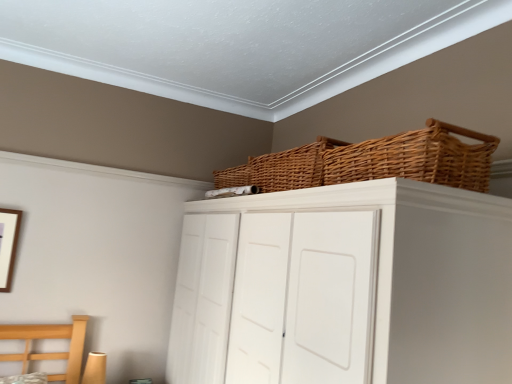
This screenshot has width=512, height=384. What do you see at coordinates (414, 158) in the screenshot?
I see `woven brown basket at upper center, arranged as the second basket when viewed from the back` at bounding box center [414, 158].

Locate an element on the screen. The height and width of the screenshot is (384, 512). wooden picture frame at left is located at coordinates (8, 245).

From a real-world perspective, is white matte cupboard at upper center beneath woven brown basket at upper center, the 2th basket in the front-to-back sequence?

Indeed, from a real-world perspective, white matte cupboard at upper center is positioned beneath woven brown basket at upper center, the 2th basket in the front-to-back sequence.

From the image's perspective, is white matte cupboard at upper center located above or below woven brown basket at upper center, the 2th basket in the front-to-back sequence?

Clearly, from the image's perspective, white matte cupboard at upper center is below woven brown basket at upper center, the 2th basket in the front-to-back sequence.

Is white matte cupboard at upper center in front of woven brown basket at upper center, the 2th basket in the front-to-back sequence?

Yes, white matte cupboard at upper center is in front of woven brown basket at upper center, the 2th basket in the front-to-back sequence.

Which is farther, (452, 192) or (293, 160)?

The point (293, 160) is behind.

In the image, there is a woven brown basket at upper center, positioned as the 1th basket in front-to-back order. At what (x,y) coordinates should I click in order to perform the action: click on basket below it (from the image's perspective). Please return your answer as a coordinate pair (x, y). Image resolution: width=512 pixels, height=384 pixels. Looking at the image, I should click on (280, 169).

Considering the positions of points (345, 157) and (304, 165), is point (345, 157) closer to camera compared to point (304, 165)?

Yes, point (345, 157) is closer to viewer.

Could woven brown basket at upper center, which ranks as the 1th basket in back-to-front order, be considered to be inside woven brown basket at upper center, positioned as the 1th basket in front-to-back order?

No, woven brown basket at upper center, which ranks as the 1th basket in back-to-front order, is not inside woven brown basket at upper center, positioned as the 1th basket in front-to-back order.

Can you tell me how much woven brown basket at upper center, positioned as the 1th basket in front-to-back order, and woven brown basket at upper center, which ranks as the 1th basket in back-to-front order, differ in facing direction?

The angle between the facing direction of woven brown basket at upper center, positioned as the 1th basket in front-to-back order, and the facing direction of woven brown basket at upper center, which ranks as the 1th basket in back-to-front order, is 2.01e-05 degrees.

Looking at their sizes, would you say wooden picture frame at left is wider or thinner than white matte cupboard at upper center?

Considering their sizes, wooden picture frame at left looks slimmer than white matte cupboard at upper center.

From the image's perspective, which is above, wooden picture frame at left or white matte cupboard at upper center?

wooden picture frame at left, from the image's perspective.

The width and height of the screenshot is (512, 384). In order to click on cupboard located in front of the wooden picture frame at left in this screenshot , I will do `click(345, 287)`.

From the image's perspective, does woven brown basket at upper center, the 2th basket in the front-to-back sequence, appear lower than wooden picture frame at left?

No, from the image's perspective, woven brown basket at upper center, the 2th basket in the front-to-back sequence, is not beneath wooden picture frame at left.

Based on the photo, would you say woven brown basket at upper center, the 2th basket in the front-to-back sequence, is outside wooden picture frame at left?

Absolutely, woven brown basket at upper center, the 2th basket in the front-to-back sequence, is external to wooden picture frame at left.

Which of these two, woven brown basket at upper center, which ranks as the 1th basket in back-to-front order, or wooden picture frame at left, is bigger?

woven brown basket at upper center, which ranks as the 1th basket in back-to-front order.

Is wooden picture frame at left at the back of woven brown basket at upper center, which ranks as the 1th basket in back-to-front order?

No.

Is point (10, 266) in front of point (415, 162)?

No, (10, 266) is behind (415, 162).

Are wooden picture frame at left and woven brown basket at upper center, arranged as the second basket when viewed from the back, making contact?

No, wooden picture frame at left is not in contact with woven brown basket at upper center, arranged as the second basket when viewed from the back.

Locate an element on the screen. picture frame below the woven brown basket at upper center, positioned as the 1th basket in front-to-back order (from a real-world perspective) is located at coordinates (8, 245).

From the image's perspective, which object appears higher, wooden picture frame at left or woven brown basket at upper center, arranged as the second basket when viewed from the back?

woven brown basket at upper center, arranged as the second basket when viewed from the back, is shown above in the image.

Can you confirm if woven brown basket at upper center, arranged as the second basket when viewed from the back, is smaller than wooden picture frame at left?

Incorrect, woven brown basket at upper center, arranged as the second basket when viewed from the back, is not smaller in size than wooden picture frame at left.

In order to click on picture frame that appears behind the woven brown basket at upper center, positioned as the 1th basket in front-to-back order in this screenshot , I will do `click(8, 245)`.

Is woven brown basket at upper center, arranged as the second basket when viewed from the back, to the left of wooden picture frame at left from the viewer's perspective?

No.

Which of these two, woven brown basket at upper center, positioned as the 1th basket in front-to-back order, or white matte cupboard at upper center, is thinner?

With smaller width is woven brown basket at upper center, positioned as the 1th basket in front-to-back order.

In terms of height, does woven brown basket at upper center, arranged as the second basket when viewed from the back, look taller or shorter compared to white matte cupboard at upper center?

woven brown basket at upper center, arranged as the second basket when viewed from the back, is shorter than white matte cupboard at upper center.

Can we say woven brown basket at upper center, positioned as the 1th basket in front-to-back order, lies outside white matte cupboard at upper center?

woven brown basket at upper center, positioned as the 1th basket in front-to-back order, lies outside white matte cupboard at upper center's area.

This screenshot has width=512, height=384. Identify the location of cupboard that is on the left side of woven brown basket at upper center, arranged as the second basket when viewed from the back. 345,287.

The height and width of the screenshot is (384, 512). Identify the location of cupboard that appears in front of the woven brown basket at upper center, which ranks as the 1th basket in back-to-front order. (345, 287).

Identify the location of basket behind the woven brown basket at upper center, arranged as the second basket when viewed from the back. The image size is (512, 384). (280, 169).

Based on their spatial positions, is white matte cupboard at upper center or wooden picture frame at left closer to woven brown basket at upper center, the 2th basket in the front-to-back sequence?

The object closer to woven brown basket at upper center, the 2th basket in the front-to-back sequence, is white matte cupboard at upper center.

From the image, which object appears to be farther from wooden picture frame at left, woven brown basket at upper center, positioned as the 1th basket in front-to-back order, or woven brown basket at upper center, which ranks as the 1th basket in back-to-front order?

Based on the image, woven brown basket at upper center, positioned as the 1th basket in front-to-back order, appears to be further to wooden picture frame at left.

From the image, which object appears to be farther from wooden picture frame at left, white matte cupboard at upper center or woven brown basket at upper center, arranged as the second basket when viewed from the back?

woven brown basket at upper center, arranged as the second basket when viewed from the back, lies further to wooden picture frame at left than the other object.

From the picture: Considering their positions, is woven brown basket at upper center, the 2th basket in the front-to-back sequence, positioned further to white matte cupboard at upper center than woven brown basket at upper center, arranged as the second basket when viewed from the back?

woven brown basket at upper center, the 2th basket in the front-to-back sequence, is positioned further to the anchor white matte cupboard at upper center.

From the image, which object appears to be nearer to woven brown basket at upper center, arranged as the second basket when viewed from the back, woven brown basket at upper center, the 2th basket in the front-to-back sequence, or wooden picture frame at left?

woven brown basket at upper center, the 2th basket in the front-to-back sequence, is closer to woven brown basket at upper center, arranged as the second basket when viewed from the back.

Looking at this image, based on their spatial positions, is woven brown basket at upper center, the 2th basket in the front-to-back sequence, or white matte cupboard at upper center closer to woven brown basket at upper center, arranged as the second basket when viewed from the back?

white matte cupboard at upper center lies closer to woven brown basket at upper center, arranged as the second basket when viewed from the back, than the other object.

Which object lies further to the anchor point white matte cupboard at upper center, wooden picture frame at left or woven brown basket at upper center, which ranks as the 1th basket in back-to-front order?

wooden picture frame at left lies further to white matte cupboard at upper center than the other object.

Estimate the real-world distances between objects in this image. Which object is further from woven brown basket at upper center, which ranks as the 1th basket in back-to-front order, wooden picture frame at left or woven brown basket at upper center, arranged as the second basket when viewed from the back?

The object further to woven brown basket at upper center, which ranks as the 1th basket in back-to-front order, is wooden picture frame at left.

Find the location of a particular element. The image size is (512, 384). cupboard between wooden picture frame at left and woven brown basket at upper center, positioned as the 1th basket in front-to-back order, from left to right is located at coordinates (345, 287).

Locate an element on the screen. Image resolution: width=512 pixels, height=384 pixels. basket between woven brown basket at upper center, arranged as the second basket when viewed from the back, and white matte cupboard at upper center from top to bottom is located at coordinates (280, 169).

Where is `cupboard between wooden picture frame at left and woven brown basket at upper center, the 2th basket in the front-to-back sequence`? This screenshot has width=512, height=384. cupboard between wooden picture frame at left and woven brown basket at upper center, the 2th basket in the front-to-back sequence is located at coordinates (345, 287).

The height and width of the screenshot is (384, 512). I want to click on basket located between wooden picture frame at left and woven brown basket at upper center, positioned as the 1th basket in front-to-back order, in the left-right direction, so click(x=280, y=169).